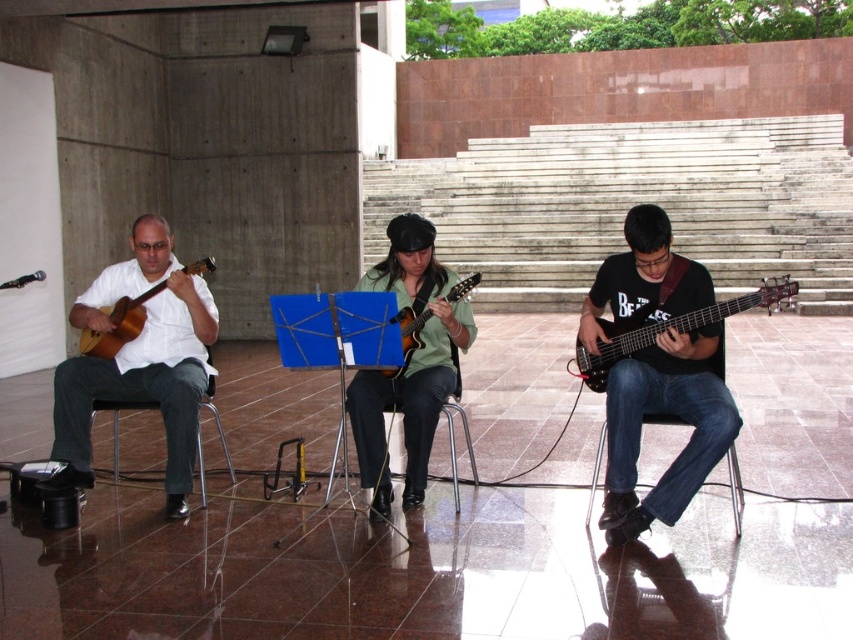
You are a spectator standing at the front of the performance area. You want to take a photo of both the wooden acoustic guitar at left and the matte green guitar at center. Which guitar should you position closer to the front to ensure both are in the frame?

The wooden acoustic guitar at left should be positioned closer to the front because the matte green guitar at center is behind it, so moving the wooden acoustic guitar forward would allow both guitars to be visible in the photo.

You are organizing a music event and need to place a large amplifier next to the shiny black electric guitar at center right and the wooden acoustic guitar at left. Which guitar should the amplifier be placed closer to, based on their sizes?

The amplifier should be placed closer to the shiny black electric guitar at center right because it is larger in size than the wooden acoustic guitar at left, requiring more space.